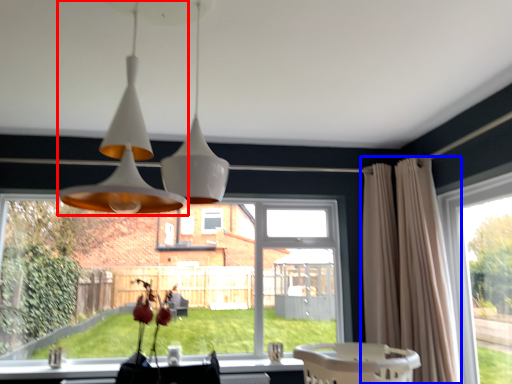
Question: Among these objects, which one is nearest to the camera, lamp (highlighted by a red box) or curtain (highlighted by a blue box)?

Choices:
 (A) lamp
 (B) curtain

Answer: (A)